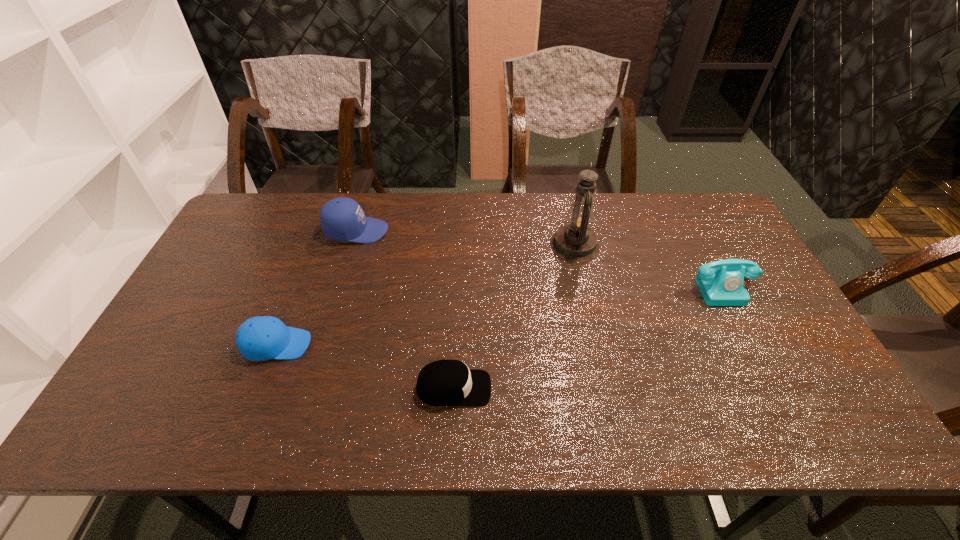
Locate an element on the screen. vacant region that satisfies the following two spatial constraints: 1. on the front-facing side of the farthest cap; 2. on the right side of the tallest object is located at coordinates (352, 245).